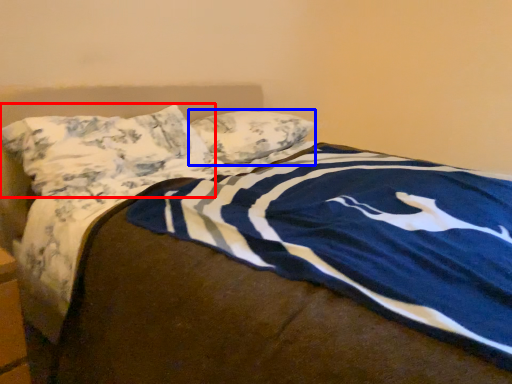
Question: Among these objects, which one is farthest to the camera, pillow (highlighted by a red box) or pillow (highlighted by a blue box)?

Choices:
 (A) pillow
 (B) pillow

Answer: (B)